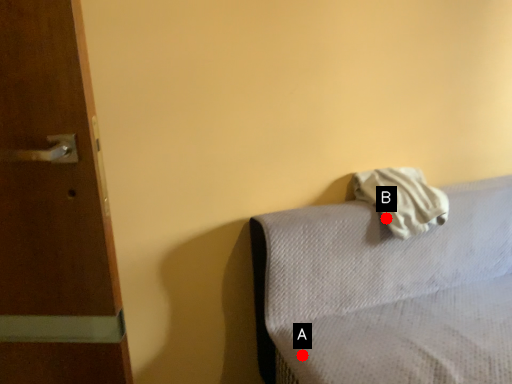
Question: Two points are circled on the image, labeled by A and B beside each circle. Among these points, which one is farthest from the camera?

Choices:
 (A) A is further
 (B) B is further

Answer: (B)